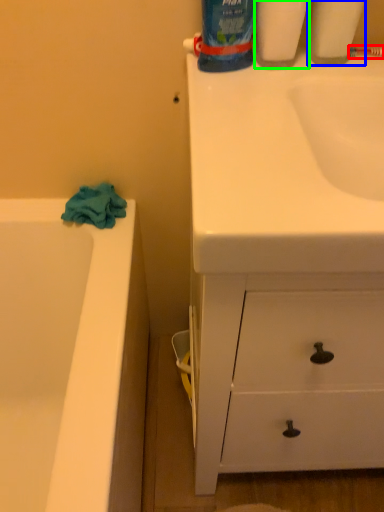
Question: Which object is the farthest from toothbrush (highlighted by a red box)? Choose among these: cleaning product (highlighted by a blue box) or cleaning product (highlighted by a green box).

Choices:
 (A) cleaning product
 (B) cleaning product

Answer: (B)